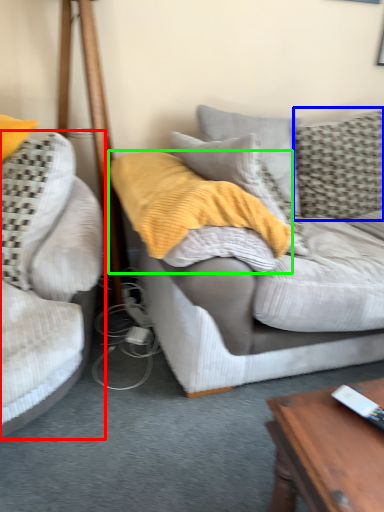
Question: Which is nearer to the studio couch (highlighted by a red box)? pillow (highlighted by a blue box) or blanket (highlighted by a green box).

Choices:
 (A) pillow
 (B) blanket

Answer: (B)